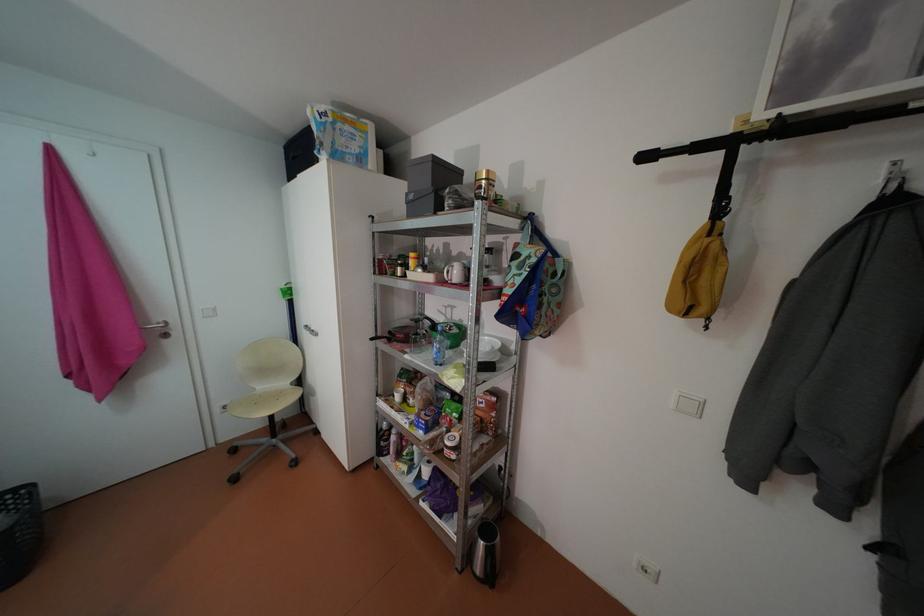
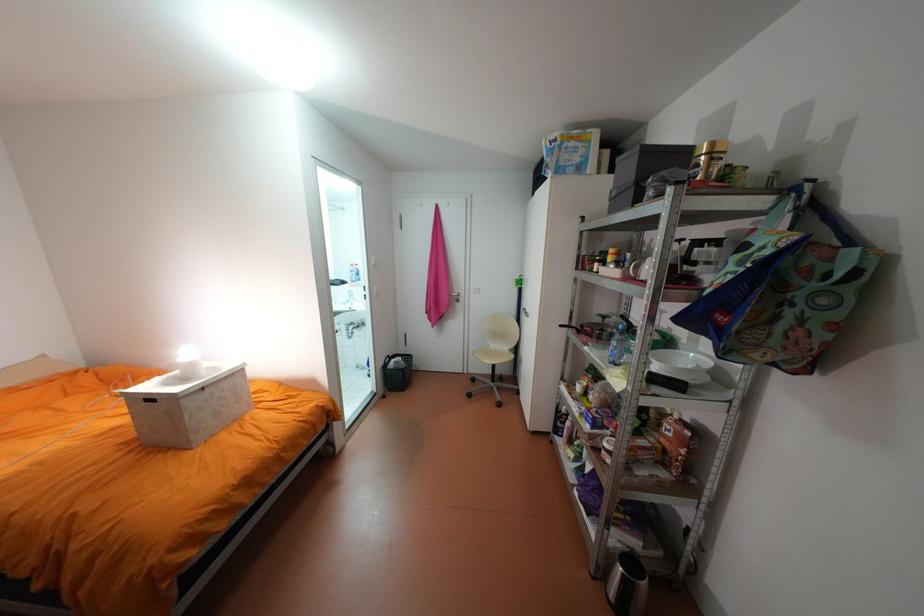
In the second image, find the point that corresponds to point 497,171 in the first image.

(722, 143)